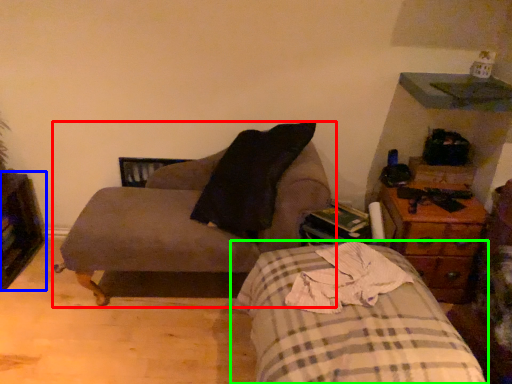
Question: Which object is the closest to the chair (highlighted by a red box)? Choose among these: dresser (highlighted by a blue box) or bed (highlighted by a green box).

Choices:
 (A) dresser
 (B) bed

Answer: (B)